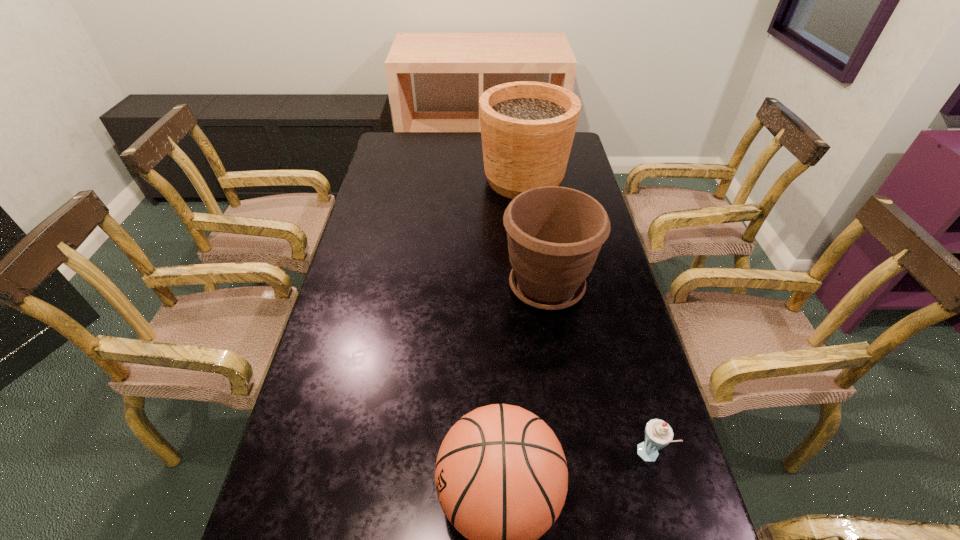
At what (x,y) coordinates should I click in order to perform the action: click on the farthest object. Please return your answer as a coordinate pair (x, y). Image resolution: width=960 pixels, height=540 pixels. Looking at the image, I should click on (527, 128).

The width and height of the screenshot is (960, 540). In order to click on the shorter flowerpot in this screenshot , I will do tap(555, 234).

At what (x,y) coordinates should I click in order to perform the action: click on the nearer flowerpot. Please return your answer as a coordinate pair (x, y). This screenshot has width=960, height=540. Looking at the image, I should click on (555, 234).

You are a GUI agent. You are given a task and a screenshot of the screen. Output one action in this format:
    pyautogui.click(x=<x>, y=<y>)
    Task: Click on the shortest object
    This screenshot has width=960, height=540.
    Given the screenshot: What is the action you would take?
    pyautogui.click(x=658, y=434)

At what (x,y) coordinates should I click in order to perform the action: click on free space located on the left of the farthest object. Please return your answer as a coordinate pair (x, y). Image resolution: width=960 pixels, height=540 pixels. Looking at the image, I should click on (416, 180).

I want to click on free space located on the back of the shorter flowerpot, so click(x=540, y=244).

Find the location of a particular element. The height and width of the screenshot is (540, 960). free space located on the straw side of the shortest object is located at coordinates (593, 456).

Image resolution: width=960 pixels, height=540 pixels. I want to click on vacant space located on the straw side of the shortest object, so click(569, 456).

Locate an element on the screen. This screenshot has height=540, width=960. vacant space located on the straw side of the shortest object is located at coordinates (598, 456).

In order to click on object that is at the far edge in this screenshot , I will do `click(527, 128)`.